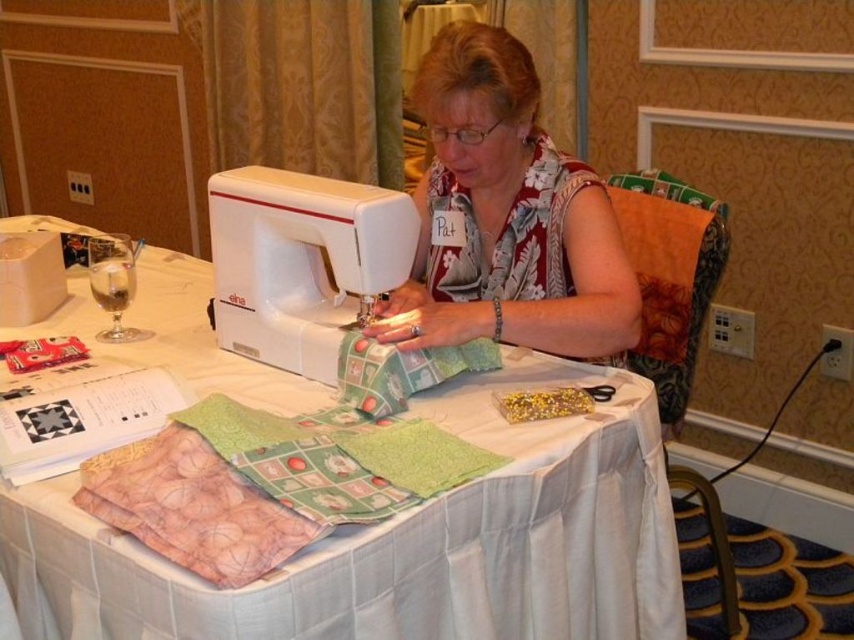
Does white floral blouse at center come behind white plastic sewing machine at center?

That is True.

Which is below, white floral blouse at center or white plastic sewing machine at center?

Positioned lower is white plastic sewing machine at center.

Where is `white floral blouse at center`? This screenshot has height=640, width=854. white floral blouse at center is located at coordinates (507, 216).

Does white cloth table at center appear under white floral blouse at center?

Yes.

Is white cloth table at center smaller than white floral blouse at center?

Incorrect, white cloth table at center is not smaller in size than white floral blouse at center.

What do you see at coordinates (402, 544) in the screenshot? I see `white cloth table at center` at bounding box center [402, 544].

Image resolution: width=854 pixels, height=640 pixels. What are the coordinates of `white cloth table at center` in the screenshot? It's located at (402, 544).

Can you confirm if white cloth table at center is shorter than white plastic sewing machine at center?

No.

Who is more distant from viewer, [108,636] or [281,305]?

Point [281,305]

The height and width of the screenshot is (640, 854). In order to click on white cloth table at center in this screenshot , I will do `click(402, 544)`.